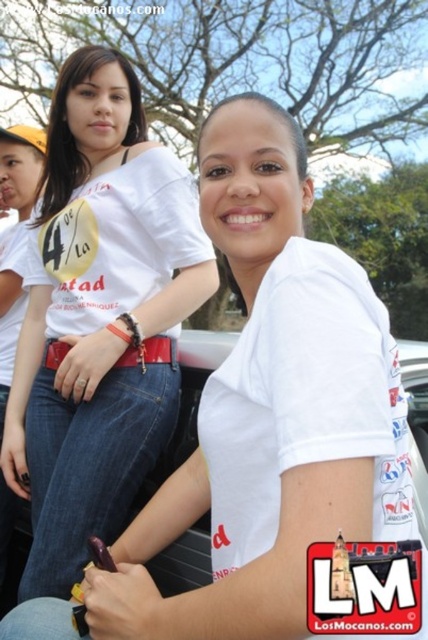
Which is in front, point (71, 154) or point (17, 294)?

Point (71, 154) is in front.

Does point (98, 58) come closer to viewer compared to point (8, 314)?

Yes, point (98, 58) is in front of point (8, 314).

Does point (50, 296) come closer to viewer compared to point (5, 163)?

Yes, point (50, 296) is closer to viewer.

At what (x,y) coordinates should I click in order to perform the action: click on white matte t-shirt at center. Please return your answer as a coordinate pair (x, y). Looking at the image, I should click on (100, 317).